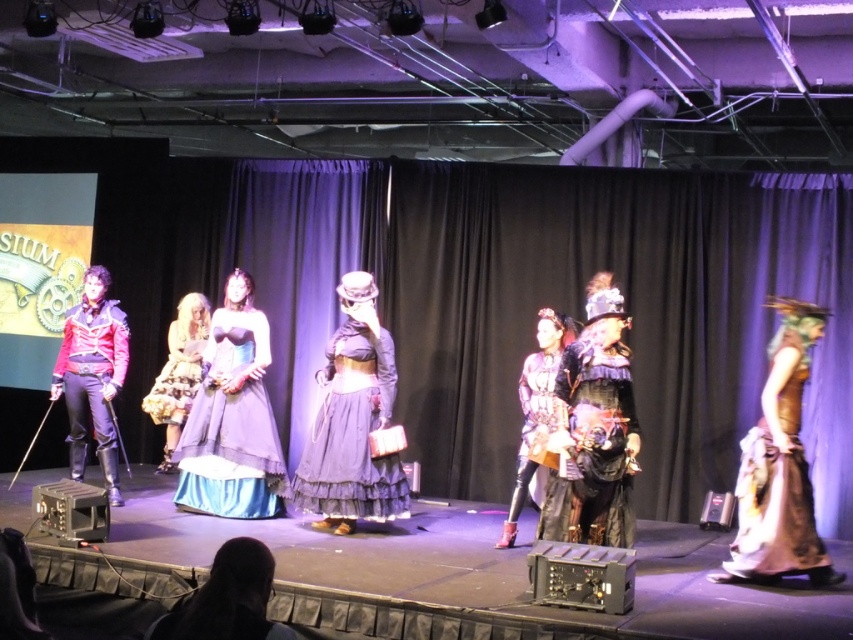
Does gray satin dress at center have a lesser height compared to brown leather dress at right?

In fact, gray satin dress at center may be taller than brown leather dress at right.

Who is more distant from viewer, (x=358, y=420) or (x=791, y=429)?

Point (x=358, y=420)

You are a GUI agent. You are given a task and a screenshot of the screen. Output one action in this format:
    pyautogui.click(x=<x>, y=<y>)
    Task: Click on the gray satin dress at center
    
    Given the screenshot: What is the action you would take?
    pyautogui.click(x=352, y=435)

In the scene shown: Between blue satin dress at center and leather-like black dress at center, which one appears on the left side from the viewer's perspective?

blue satin dress at center

Is point (198, 506) behind point (527, 424)?

Yes, it is.

What do you see at coordinates (231, 426) in the screenshot?
I see `blue satin dress at center` at bounding box center [231, 426].

Locate an element on the screen. blue satin dress at center is located at coordinates (231, 426).

Who is higher up, brown leather dress at right or floral-patterned fabric dress at center?

floral-patterned fabric dress at center

Is point (805, 518) closer to viewer compared to point (184, 300)?

Yes.

You are a GUI agent. You are given a task and a screenshot of the screen. Output one action in this format:
    pyautogui.click(x=<x>, y=<y>)
    Task: Click on the brown leather dress at right
    The image size is (853, 640).
    Given the screenshot: What is the action you would take?
    pyautogui.click(x=776, y=484)